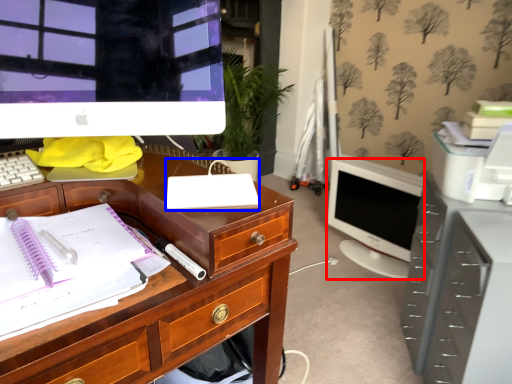
Question: Which of the following is the farthest to the observer, computer monitor (highlighted by a red box) or office supplies (highlighted by a blue box)?

Choices:
 (A) computer monitor
 (B) office supplies

Answer: (A)